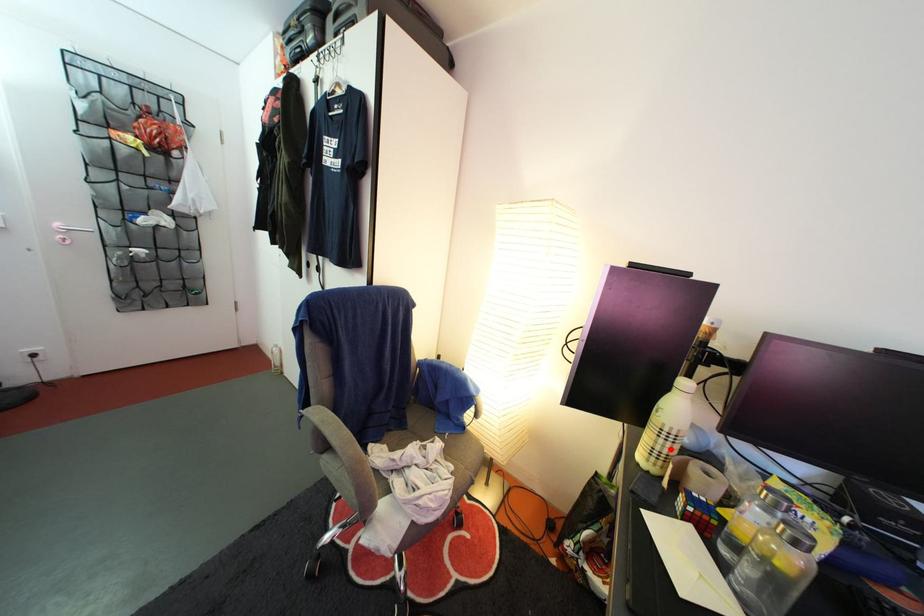
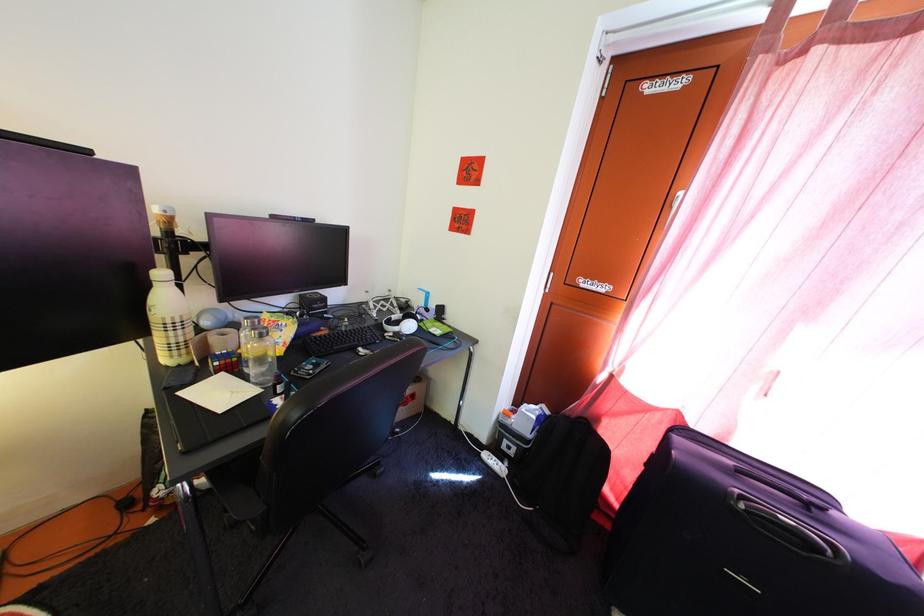
Where in the second image is the point corresponding to the highlighted location from the first image?

(179, 341)